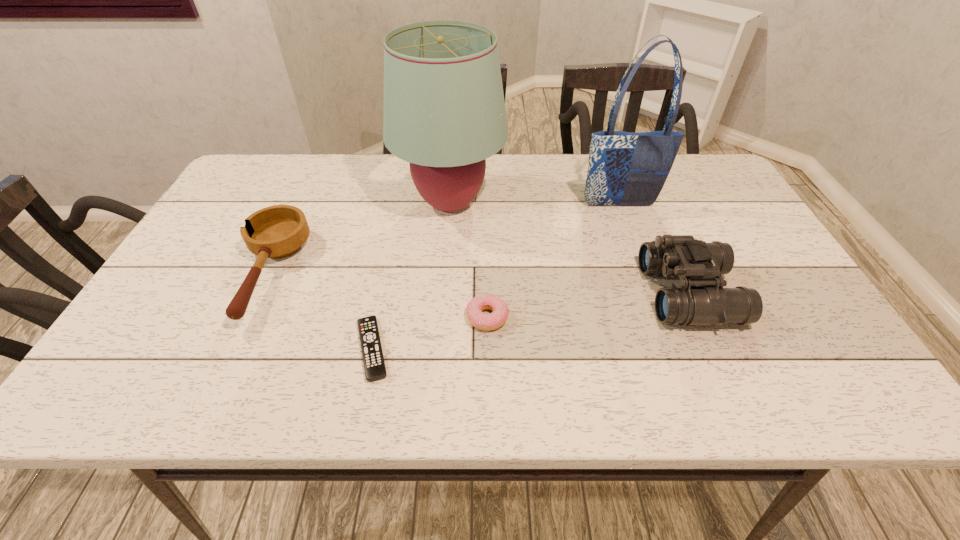
You are a GUI agent. You are given a task and a screenshot of the screen. Output one action in this format:
    pyautogui.click(x=<x>, y=<y>)
    Task: Click on the lampshade
    This screenshot has width=960, height=540.
    Given the screenshot: What is the action you would take?
    pyautogui.click(x=444, y=112)

The width and height of the screenshot is (960, 540). In order to click on shopping bag in this screenshot , I will do `click(625, 168)`.

This screenshot has width=960, height=540. Identify the location of binoculars. (701, 300).

The height and width of the screenshot is (540, 960). What are the coordinates of `saucepan` in the screenshot? It's located at (279, 231).

Locate an element on the screen. This screenshot has width=960, height=540. the leftmost object is located at coordinates (279, 231).

What are the coordinates of `doughnut` in the screenshot? It's located at (478, 319).

The image size is (960, 540). What are the coordinates of `the shortest object` in the screenshot? It's located at (374, 366).

You are a GUI agent. You are given a task and a screenshot of the screen. Output one action in this format:
    pyautogui.click(x=<x>, y=<y>)
    Task: Click on the blank space located 0.320m on the right of the lampshade
    The width and height of the screenshot is (960, 540).
    Given the screenshot: What is the action you would take?
    (x=618, y=203)

Identify the location of vacant space located on the front-facing side of the shopping bag. (627, 229).

At what (x,y) coordinates should I click in order to perform the action: click on vacant space situated through the lenses of the fourth shortest object. Please return your answer as a coordinate pair (x, y). Looking at the image, I should click on (599, 293).